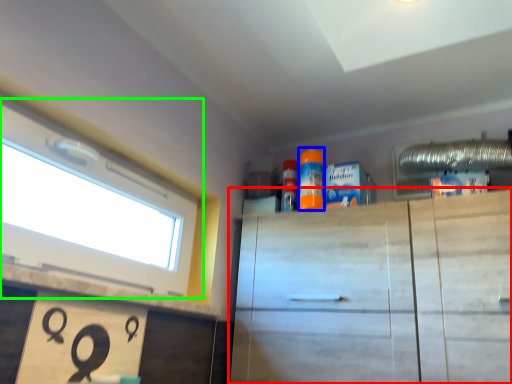
Question: Considering the real-world distances, which object is farthest from cabinetry (highlighted by a red box)? cleaning product (highlighted by a blue box) or window (highlighted by a green box)?

Choices:
 (A) cleaning product
 (B) window

Answer: (B)